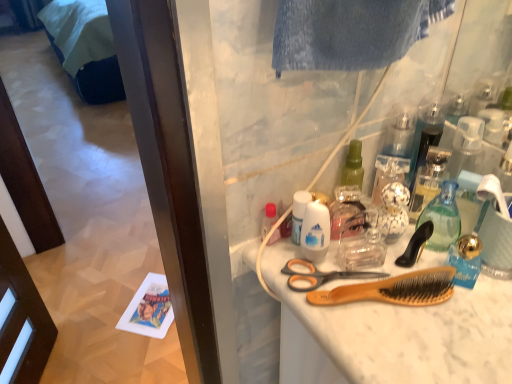
You are a GUI agent. You are given a task and a screenshot of the screen. Output one action in this format:
    pyautogui.click(x=<x>, y=<y>)
    Task: Click on the white glossy mouthwash at center
    
    Given the screenshot: What is the action you would take?
    pyautogui.click(x=298, y=213)

The width and height of the screenshot is (512, 384). What do you see at coordinates (85, 48) in the screenshot? I see `dark blue fabric bed at lower left` at bounding box center [85, 48].

In order to click on dark blue fabric bed at lower left in this screenshot , I will do `click(85, 48)`.

In order to click on wooden bristle brush at center, which is the second brush from top to bottom in this screenshot , I will do `click(394, 289)`.

Locate an element on the screen. The width and height of the screenshot is (512, 384). transparent plastic bottle at center, the 2th cleaning product positioned from the front is located at coordinates (344, 207).

In order to face transparent plastic bottle at center, placed as the 1th cleaning product when sorted from right to left, should I rotate leftwards or rightwards?

A 11.807 degree turn to the right will do.

You are a GUI agent. You are given a task and a screenshot of the screen. Output one action in this format:
    pyautogui.click(x=<x>, y=<y>)
    Task: Click on the white matte deodorant at center, placed as the first cleaning product when sorted from left to right
    The height and width of the screenshot is (384, 512).
    Given the screenshot: What is the action you would take?
    pyautogui.click(x=315, y=232)

At what (x,y) coordinates should I click in order to perform the action: click on white glossy mouthwash at center. Please return your answer as a coordinate pair (x, y). The height and width of the screenshot is (384, 512). Looking at the image, I should click on pyautogui.click(x=298, y=213).

From the image's perspective, is black plastic brush at upper right, the 1th brush positioned from the top, under transparent glass perfume at upper right?

Yes.

Can you confirm if black plastic brush at upper right, the 1th brush positioned from the top, is shorter than transparent glass perfume at upper right?

Correct, black plastic brush at upper right, the 1th brush positioned from the top, is not as tall as transparent glass perfume at upper right.

Between black plastic brush at upper right, which appears as the second brush when ordered from the bottom, and transparent glass perfume at upper right, which one has larger width?

Wider between the two is transparent glass perfume at upper right.

Which is behind, point (506, 219) or point (338, 238)?

The point (338, 238) is behind.

From a real-world perspective, is gold metallic coffee cup at upper right positioned above or below transparent plastic bottle at center, placed as the 1th cleaning product when sorted from right to left?

gold metallic coffee cup at upper right is above transparent plastic bottle at center, placed as the 1th cleaning product when sorted from right to left.

How distant is gold metallic coffee cup at upper right from transparent plastic bottle at center, the 2th cleaning product positioned from the front?

A distance of 9.37 inches exists between gold metallic coffee cup at upper right and transparent plastic bottle at center, the 2th cleaning product positioned from the front.

Considering the relative sizes of gold metallic coffee cup at upper right and transparent plastic bottle at center, which ranks as the 2th cleaning product in left-to-right order, in the image provided, is gold metallic coffee cup at upper right wider than transparent plastic bottle at center, which ranks as the 2th cleaning product in left-to-right order,?

Yes, gold metallic coffee cup at upper right is wider than transparent plastic bottle at center, which ranks as the 2th cleaning product in left-to-right order.

Measure the distance between orange plastic scissors at center and white matte deodorant at center, the second cleaning product viewed from the right.

A distance of 1.99 inches exists between orange plastic scissors at center and white matte deodorant at center, the second cleaning product viewed from the right.

Between orange plastic scissors at center and white matte deodorant at center, placed as the first cleaning product when sorted from left to right, which one has larger size?

With larger size is white matte deodorant at center, placed as the first cleaning product when sorted from left to right.

Is orange plastic scissors at center positioned before white matte deodorant at center, which ranks as the first cleaning product in front-to-back order?

No, orange plastic scissors at center is further to the viewer.

How many degrees apart are the facing directions of orange plastic scissors at center and white matte deodorant at center, the second cleaning product viewed from the right?

10.6 degrees separate the facing orientations of orange plastic scissors at center and white matte deodorant at center, the second cleaning product viewed from the right.

From a real-world perspective, is gold metallic coffee cup at upper right above or below transparent glass perfume at upper right?

Clearly, from a real-world perspective, gold metallic coffee cup at upper right is below transparent glass perfume at upper right.

Is gold metallic coffee cup at upper right to the right of transparent glass perfume at upper right from the viewer's perspective?

Indeed, gold metallic coffee cup at upper right is positioned on the right side of transparent glass perfume at upper right.

From the image's perspective, which object appears higher, gold metallic coffee cup at upper right or transparent glass perfume at upper right?

transparent glass perfume at upper right appears higher in the image.

From the picture: Is gold metallic coffee cup at upper right spatially inside transparent glass perfume at upper right, or outside of it?

The correct answer is: outside.

Is white matte deodorant at center, the second cleaning product viewed from the right, positioned with its back to white glossy mouthwash at center?

Absolutely, white matte deodorant at center, the second cleaning product viewed from the right, is directed away from white glossy mouthwash at center.

Which object is positioned more to the left, white matte deodorant at center, the second cleaning product viewed from the right, or white glossy mouthwash at center?

white glossy mouthwash at center is more to the left.

The width and height of the screenshot is (512, 384). I want to click on mouthwash behind the white matte deodorant at center, which ranks as the first cleaning product in front-to-back order, so click(298, 213).

Between white matte deodorant at center, which ranks as the first cleaning product in front-to-back order, and white glossy mouthwash at center, which one is positioned behind?

white glossy mouthwash at center is more distant.

From the picture: In terms of size, does transparent glass perfume at upper right appear bigger or smaller than white matte deodorant at center, the second cleaning product viewed from the right?

transparent glass perfume at upper right is bigger than white matte deodorant at center, the second cleaning product viewed from the right.

Does transparent glass perfume at upper right turn towards white matte deodorant at center, placed as the first cleaning product when sorted from left to right?

No, transparent glass perfume at upper right is not turned towards white matte deodorant at center, placed as the first cleaning product when sorted from left to right.

Is the depth of transparent glass perfume at upper right less than that of white matte deodorant at center, the second cleaning product viewed from the right?

That is False.

Which of these two, transparent glass perfume at upper right or white matte deodorant at center, which ranks as the first cleaning product in front-to-back order, is thinner?

Thinner between the two is white matte deodorant at center, which ranks as the first cleaning product in front-to-back order.

Considering the sizes of transparent glass perfume at upper right and orange plastic scissors at center in the image, is transparent glass perfume at upper right taller or shorter than orange plastic scissors at center?

Clearly, transparent glass perfume at upper right is taller compared to orange plastic scissors at center.

Considering the relative positions of transparent glass perfume at upper right and orange plastic scissors at center in the image provided, is transparent glass perfume at upper right to the right of orange plastic scissors at center from the viewer's perspective?

Correct, you'll find transparent glass perfume at upper right to the right of orange plastic scissors at center.

Which of these two, transparent glass perfume at upper right or orange plastic scissors at center, is thinner?

transparent glass perfume at upper right.

Could orange plastic scissors at center be considered to be inside transparent glass perfume at upper right?

Definitely not — orange plastic scissors at center is not inside transparent glass perfume at upper right.

Find the location of `bottle that appears on the right of black plastic brush at upper right, the 1th brush positioned from the top`. bottle that appears on the right of black plastic brush at upper right, the 1th brush positioned from the top is located at coordinates (442, 218).

Starting from the gold metallic coffee cup at upper right, which cleaning product is the 2nd one behind? Please provide its 2D coordinates.

[(344, 207)]

Based on their spatial positions, is white matte deodorant at center, which ranks as the first cleaning product in front-to-back order, or translucent plastic bottle at center further from black plastic brush at upper right, the 1th brush positioned from the top?

The object further to black plastic brush at upper right, the 1th brush positioned from the top, is translucent plastic bottle at center.

Which object lies further to the anchor point transparent glass perfume at upper right, translucent plastic bottle at center or white matte deodorant at center, which ranks as the first cleaning product in front-to-back order?

Among the two, translucent plastic bottle at center is located further to transparent glass perfume at upper right.

When comparing their distances from black plastic brush at upper right, which appears as the second brush when ordered from the bottom, does gold metallic coffee cup at upper right or dark blue fabric bed at lower left seem closer?

Among the two, gold metallic coffee cup at upper right is located nearer to black plastic brush at upper right, which appears as the second brush when ordered from the bottom.

From the image, which object appears to be nearer to wooden bristle brush at center, which is the second brush from top to bottom, translucent plastic bottle at center or orange plastic scissors at center?

Among the two, orange plastic scissors at center is located nearer to wooden bristle brush at center, which is the second brush from top to bottom.

Which object lies nearer to the anchor point translucent plastic bottle at center, white glossy mouthwash at center or transparent glass perfume at upper right?

The object closer to translucent plastic bottle at center is white glossy mouthwash at center.

From the image, which object appears to be nearer to transparent plastic bottle at center, which ranks as the 2th cleaning product in left-to-right order, orange plastic scissors at center or transparent glass perfume at upper right?

Among the two, orange plastic scissors at center is located nearer to transparent plastic bottle at center, which ranks as the 2th cleaning product in left-to-right order.

Which object lies further to the anchor point white matte deodorant at center, placed as the first cleaning product when sorted from left to right, translucent plastic bottle at center or gold metallic coffee cup at upper right?

gold metallic coffee cup at upper right is positioned further to the anchor white matte deodorant at center, placed as the first cleaning product when sorted from left to right.

When comparing their distances from white glossy mouthwash at center, does white matte deodorant at center, the second cleaning product viewed from the right, or translucent plastic bottle at center seem closer?

white matte deodorant at center, the second cleaning product viewed from the right.

Locate an element on the screen. scissors between transparent glass perfume at upper right and dark blue fabric bed at lower left from front to back is located at coordinates (320, 275).

Find the location of `toiletry between white glossy mouthwash at center and orange plastic scissors at center from top to bottom`. toiletry between white glossy mouthwash at center and orange plastic scissors at center from top to bottom is located at coordinates (268, 219).

Identify the location of cleaning product between transparent glass perfume at upper right and dark blue fabric bed at lower left from front to back. This screenshot has width=512, height=384. (344, 207).

I want to click on mouthwash between white matte deodorant at center, marked as the 2th cleaning product in a back-to-front arrangement, and dark blue fabric bed at lower left in the front-back direction, so click(298, 213).